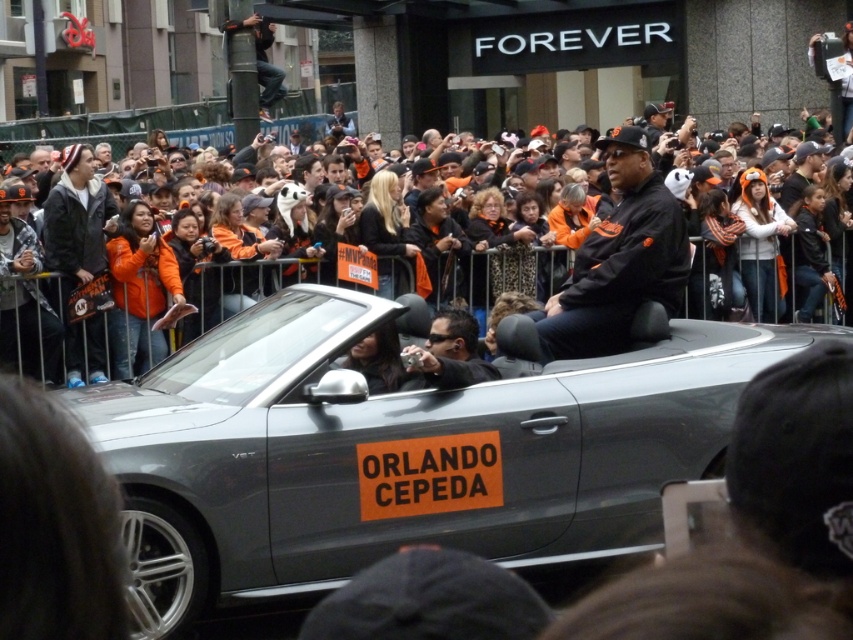
Question: Among these objects, which one is farthest from the camera?

Choices:
 (A) matte black camera at center
 (B) gray fleece jacket at left

Answer: (B)

Question: Can you confirm if satin silver convertible at center is positioned below gray fleece jacket at left?

Choices:
 (A) no
 (B) yes

Answer: (B)

Question: Is orange jersey fans at center smaller than black matte jacket at center?

Choices:
 (A) yes
 (B) no

Answer: (B)

Question: Does orange jersey fans at center appear over matte black camera at center?

Choices:
 (A) no
 (B) yes

Answer: (B)

Question: Which object is farther from the camera taking this photo?

Choices:
 (A) orange jersey fans at center
 (B) matte black camera at center

Answer: (A)

Question: Which of these objects is positioned closest to the satin silver convertible at center?

Choices:
 (A) black matte jacket at center
 (B) gray fleece jacket at left
 (C) matte black camera at center

Answer: (C)